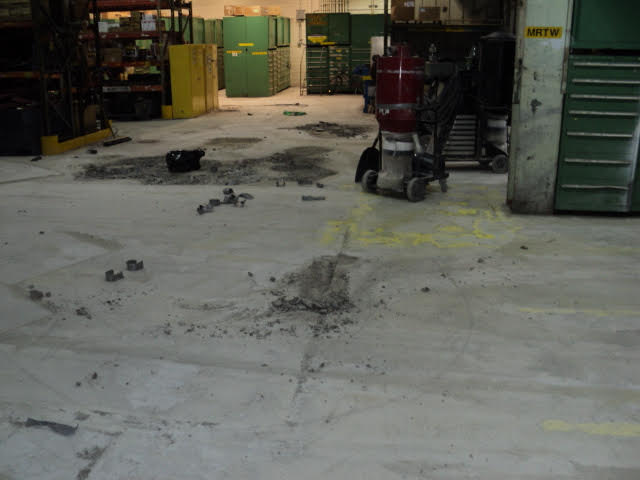
This screenshot has height=480, width=640. In order to click on wiring in this screenshot , I will do `click(300, 85)`, `click(324, 5)`, `click(374, 7)`.